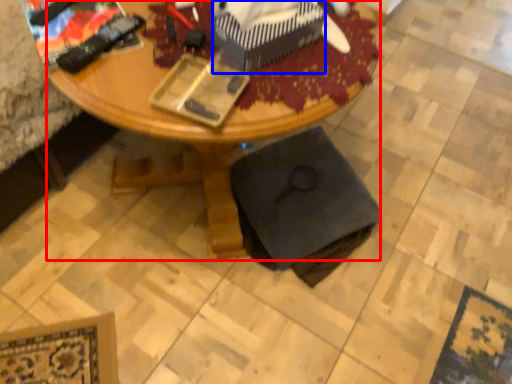
Question: Which object appears closest to the camera in this image, desk (highlighted by a red box) or box (highlighted by a blue box)?

Choices:
 (A) desk
 (B) box

Answer: (A)